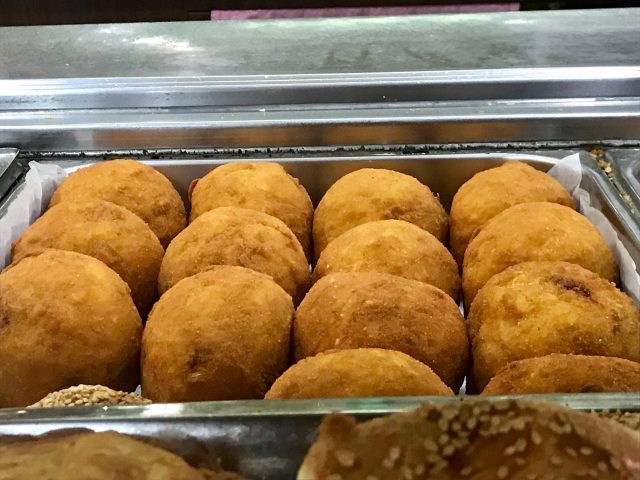
What are the coordinates of `edge of counter` in the screenshot? It's located at (348, 112), (189, 118), (557, 120).